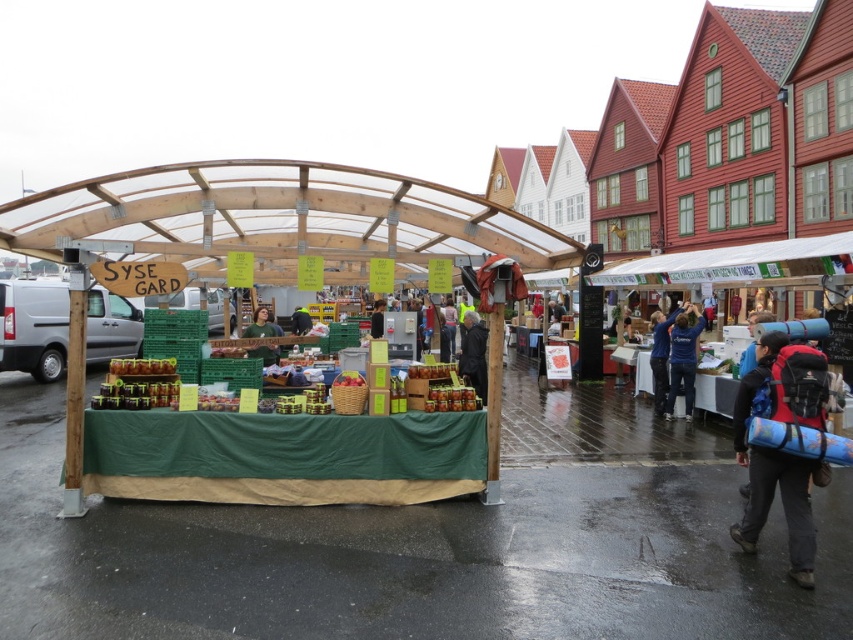
Between blue cotton shirt at center and matte black jacket at center, which one has more height?

Standing taller between the two is blue cotton shirt at center.

Does blue cotton shirt at center have a greater height compared to matte black jacket at center?

Correct, blue cotton shirt at center is much taller as matte black jacket at center.

Locate an element on the screen. blue cotton shirt at center is located at coordinates (683, 358).

Image resolution: width=853 pixels, height=640 pixels. I want to click on blue cotton shirt at center, so click(683, 358).

Does red backpack at right appear under dark gray jacket at center?

Yes, red backpack at right is below dark gray jacket at center.

Does point (813, 406) come farther from viewer compared to point (483, 369)?

No, it is not.

This screenshot has width=853, height=640. What do you see at coordinates (778, 451) in the screenshot? I see `red backpack at right` at bounding box center [778, 451].

The width and height of the screenshot is (853, 640). What are the coordinates of `red backpack at right` in the screenshot? It's located at (778, 451).

Which is below, red backpack at right or matte black jacket at center?

red backpack at right is lower down.

The height and width of the screenshot is (640, 853). What do you see at coordinates (778, 451) in the screenshot?
I see `red backpack at right` at bounding box center [778, 451].

Identify the location of red backpack at right. The width and height of the screenshot is (853, 640). (778, 451).